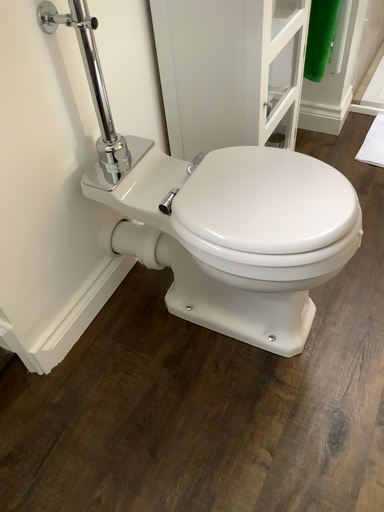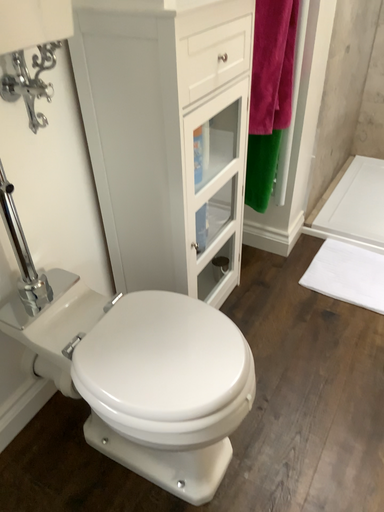
Question: How did the camera likely rotate when shooting the video?

Choices:
 (A) rotated upward
 (B) rotated downward

Answer: (A)